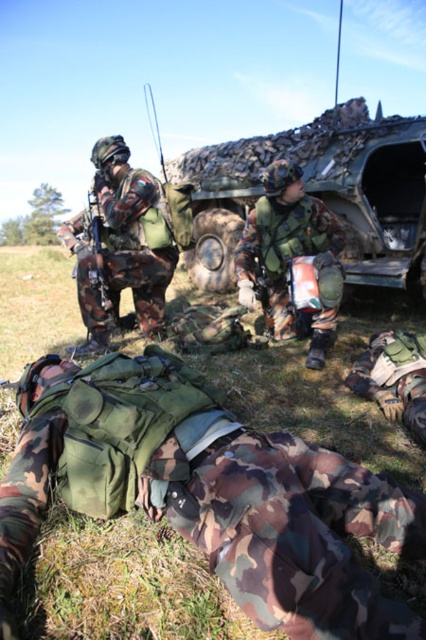
You are a medic in the field and need to quickly assess the situation. Where is the camouflage fabric vest at lower center located relative to the soldier lying on the ground?

The camouflage fabric vest at lower center is located at point [212,493], which is near the lower center area of the image, positioned close to the soldier lying on the ground.

You are a military medic assessing the scene. You see the camouflage fabric vehicle at upper center and the camouflage fabric helmet at center. Which object is wider?

The camouflage fabric vehicle at upper center is wider than the camouflage fabric helmet at center.